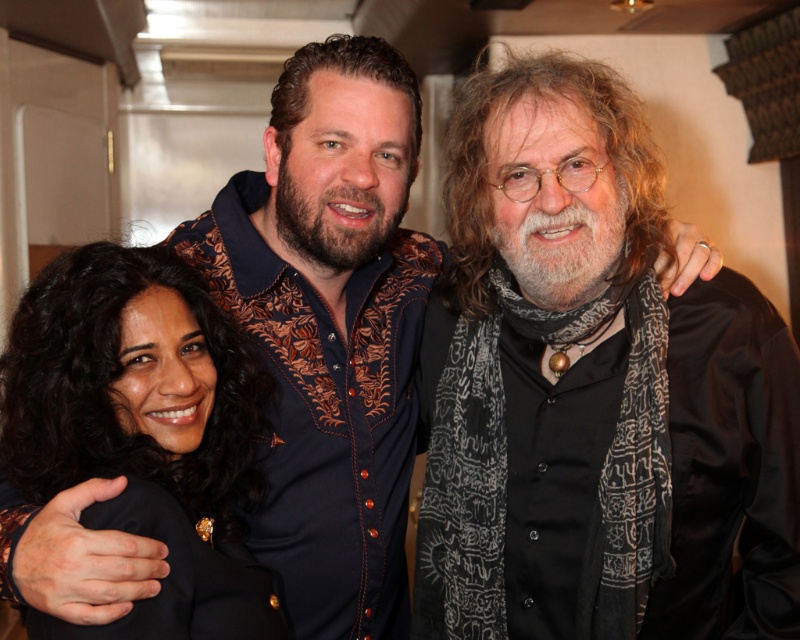
You are a photographer trying to adjust the lighting for a photo shoot. You notice the black satin shirt at center and the black satin jacket at lower left. Which item is closer to the camera, and would require more direct lighting to avoid shadows?

The black satin shirt at center is closer to the camera than the black satin jacket at lower left. Since it is closer, it would require more direct lighting to avoid shadows.